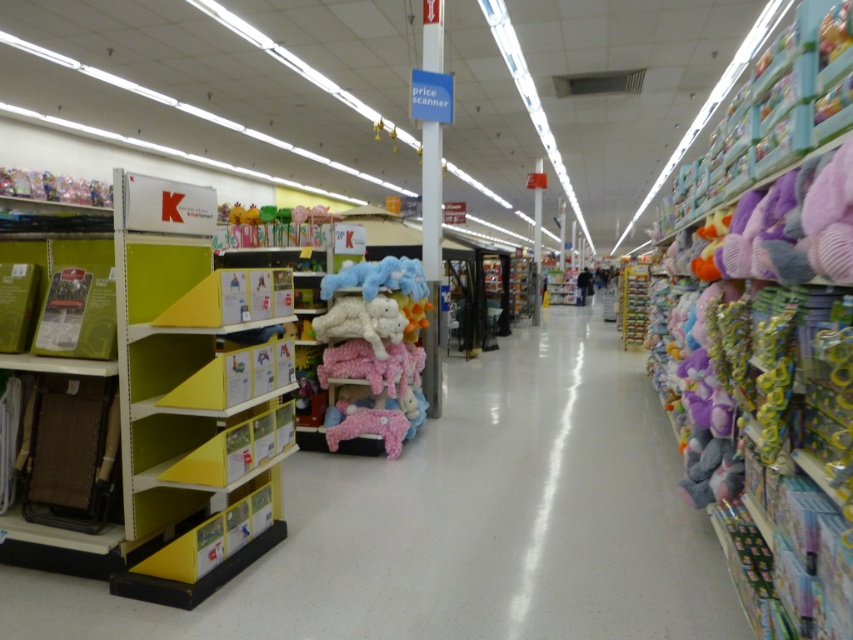
Question: Does fluffy plush toys at right have a greater width compared to fluffy pink plush at center?

Choices:
 (A) no
 (B) yes

Answer: (B)

Question: Which point is closer to the camera?

Choices:
 (A) matte pink plush at center
 (B) pastel plush toys at center
 (C) dark blue jacket at center

Answer: (B)

Question: Which point is closer to the camera?

Choices:
 (A) (834, 484)
 (B) (527, 291)
 (C) (643, 332)

Answer: (A)

Question: Which point appears closest to the camera in this image?

Choices:
 (A) (641, 301)
 (B) (583, 278)

Answer: (A)

Question: Does fluffy plush toys at right appear over matte pink plush at center?

Choices:
 (A) yes
 (B) no

Answer: (B)

Question: Does fluffy pink plush at center appear on the right side of metallic silver toy at center?

Choices:
 (A) no
 (B) yes

Answer: (A)